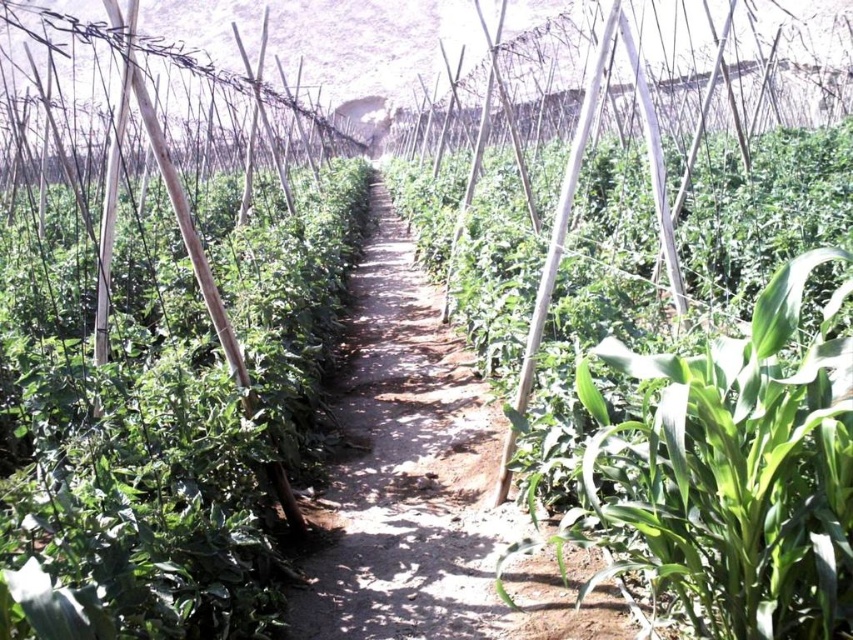
Question: Among these objects, which one is farthest from the camera?

Choices:
 (A) dirt path at center
 (B) green leafy plant at center

Answer: (A)

Question: Is green leafy plant at center bigger than dirt path at center?

Choices:
 (A) no
 (B) yes

Answer: (A)

Question: Does green leafy plant at center have a lesser width compared to dirt path at center?

Choices:
 (A) yes
 (B) no

Answer: (A)

Question: From the image, what is the correct spatial relationship of green leafy plant at center in relation to dirt path at center?

Choices:
 (A) below
 (B) above

Answer: (A)